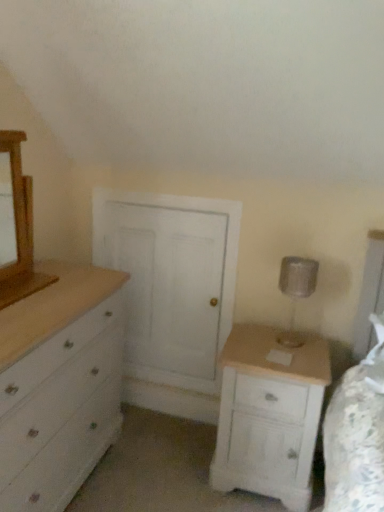
The height and width of the screenshot is (512, 384). I want to click on vacant space underneath wooden medicine cabinet at left (from a real-world perspective), so click(x=26, y=285).